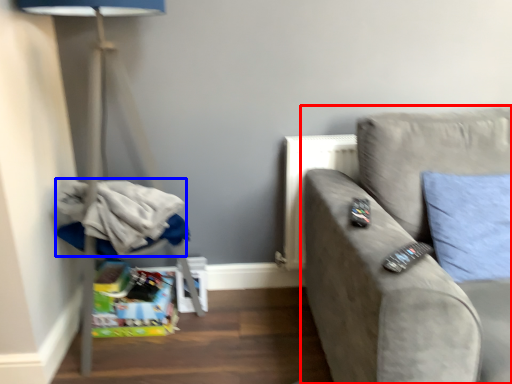
Question: Which object is further to the camera taking this photo, studio couch (highlighted by a red box) or laundry (highlighted by a blue box)?

Choices:
 (A) studio couch
 (B) laundry

Answer: (B)